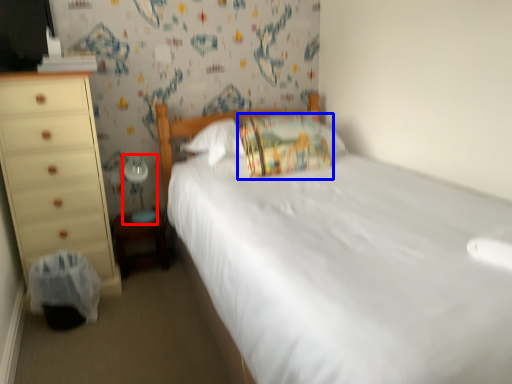
Question: Which object appears farthest to the camera in this image, table lamp (highlighted by a red box) or pillow (highlighted by a blue box)?

Choices:
 (A) table lamp
 (B) pillow

Answer: (A)